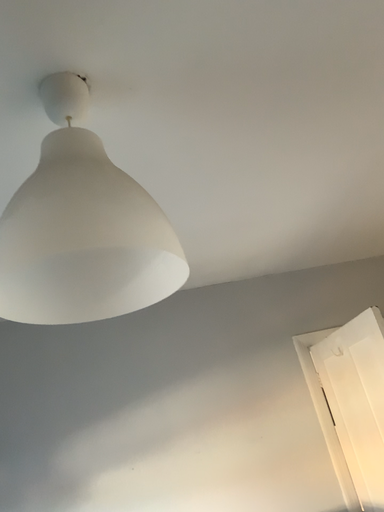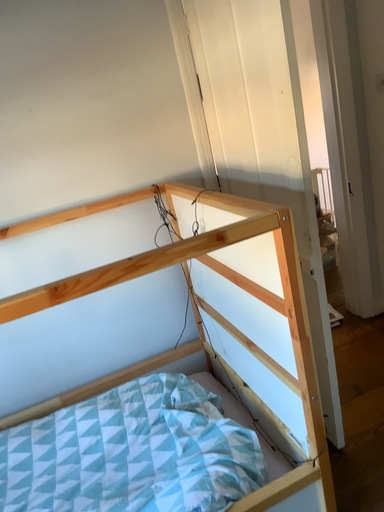
Question: How did the camera likely rotate when shooting the video?

Choices:
 (A) rotated left
 (B) rotated right

Answer: (B)